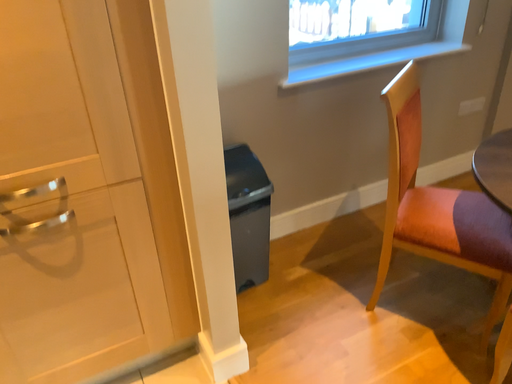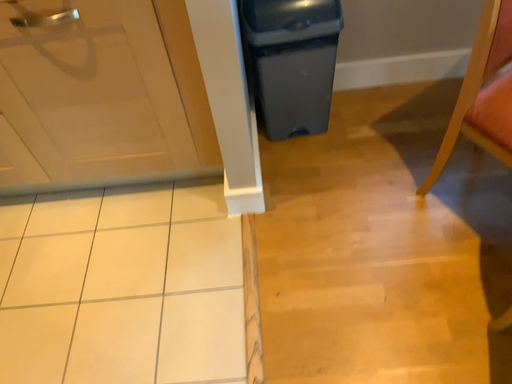
Question: How did the camera likely rotate when shooting the video?

Choices:
 (A) rotated right
 (B) rotated left

Answer: (B)